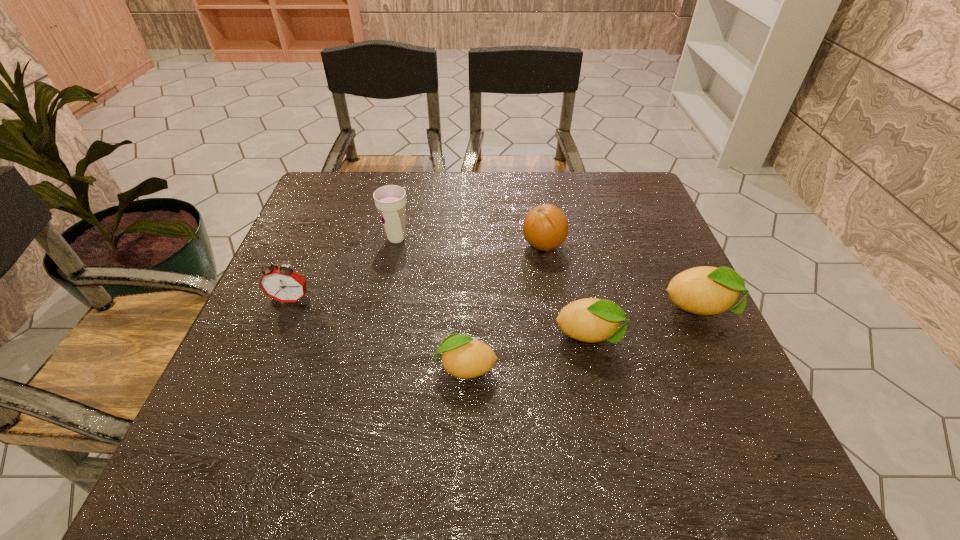
Identify the location of vacant space at the right edge of the desktop. The height and width of the screenshot is (540, 960). (681, 353).

This screenshot has width=960, height=540. In the image, there is a desktop. Find the location of `vacant space at the far left corner`. vacant space at the far left corner is located at coordinates (343, 214).

The height and width of the screenshot is (540, 960). I want to click on vacant area at the near left corner, so click(x=276, y=393).

Where is `free space between the second object from left to right and the rightmost lemon`? This screenshot has width=960, height=540. free space between the second object from left to right and the rightmost lemon is located at coordinates (548, 274).

Identify the location of free point between the shortest lemon and the second object from left to right. (431, 302).

Find the location of a particular element. free space between the rightmost lemon and the second lemon from right to left is located at coordinates (645, 323).

This screenshot has height=540, width=960. I want to click on vacant point located between the cup and the leftmost object, so click(344, 269).

Locate an element on the screen. This screenshot has width=960, height=540. unoccupied position between the cup and the orange is located at coordinates (470, 241).

I want to click on empty location between the alarm clock and the shortest lemon, so click(378, 334).

You are a GUI agent. You are given a task and a screenshot of the screen. Output one action in this format:
    pyautogui.click(x=<x>, y=<y>)
    Task: Click on the free spot between the orange and the second object from left to right
    
    Given the screenshot: What is the action you would take?
    pyautogui.click(x=470, y=241)